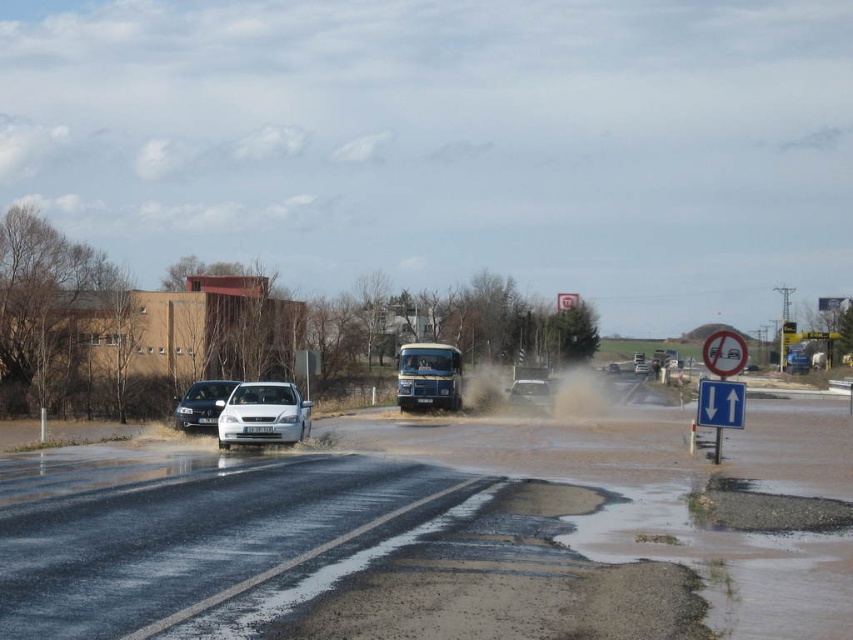
You are a driver observing the flooded road. You see a metallic silver bus at center and a matte silver suv at center. Which vehicle is more likely to avoid water entering its engine compartments?

The metallic silver bus at center is much taller as matte silver suv at center, so the metallic silver bus at center is more likely to avoid water entering its engine compartments because of its higher clearance.

You are a pedestrian trying to cross the flooded road. There is a white glossy sedan at center and a matte silver suv at center. Which vehicle should you avoid stepping on first if you want to cross safely?

You should avoid stepping on the white glossy sedan at center first because it is closer to you than the matte silver suv at center, so it poses an immediate hazard.